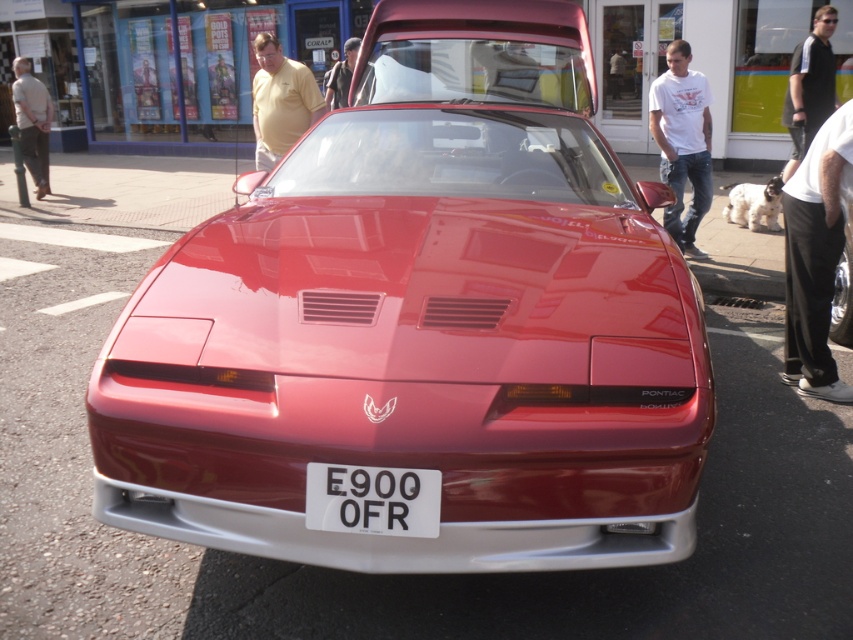
You are standing at the scene and want to take a photo of the shiny red car at center and the black jersey at upper right together in the frame. Considering your camera has a maximum focus range of 20 feet, will both objects be in focus?

The shiny red car at center is 19.08 feet away from the black jersey at upper right. Since the maximum focus range is 20 feet, both objects are within the range and will be in focus.

You are standing at point A, which is located at coordinates 0.5, 0.5. You want to walk to the shiny red car at center. In which direction should you move?

The shiny red car at center is at point (422, 323). Since you are at point A at (426, 320), you should move slightly downward and to the right to reach the shiny red car at center.

You are a photographer at a car show and notice two shirts in the background of your shot. The yellow cotton shirt at upper left and the light beige shirt at left. Which shirt is more to the right?

The yellow cotton shirt at upper left is positioned on the right side of light beige shirt at left, so the yellow cotton shirt at upper left is more to the right.